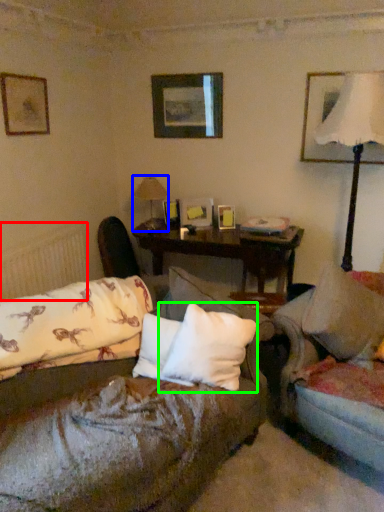
Question: Considering the real-world distances, which object is closest to radiator (highlighted by a red box)? table lamp (highlighted by a blue box) or pillow (highlighted by a green box).

Choices:
 (A) table lamp
 (B) pillow

Answer: (A)